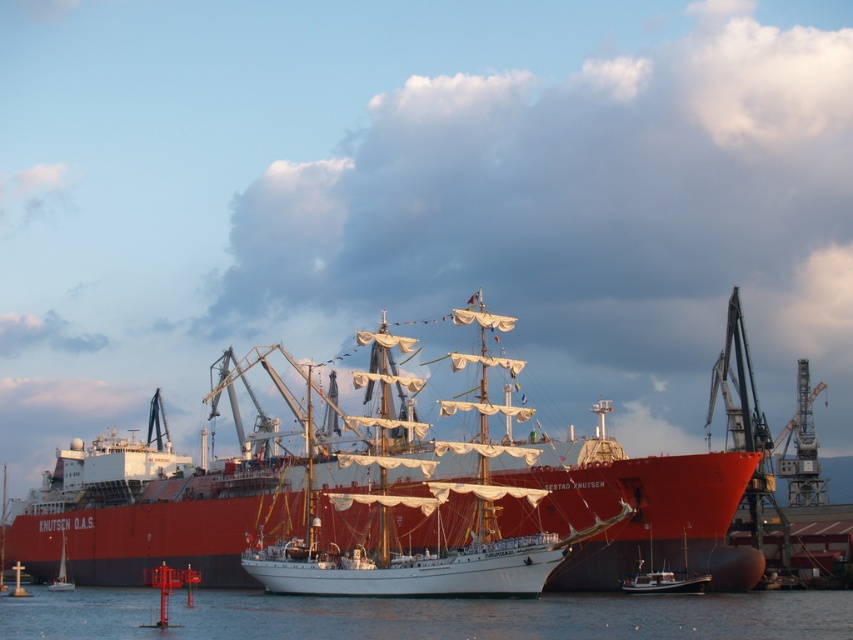
Question: Among these objects, which one is nearest to the camera?

Choices:
 (A) white sailboat at lower left
 (B) transparent water at lower center
 (C) white wooden boat at lower right

Answer: (B)

Question: Can you confirm if smooth white sailboat at center is wider than transparent water at lower center?

Choices:
 (A) yes
 (B) no

Answer: (A)

Question: Can you confirm if transparent water at lower center is bigger than white wooden boat at lower right?

Choices:
 (A) yes
 (B) no

Answer: (A)

Question: Which of the following is the closest to the observer?

Choices:
 (A) smooth white sailboat at center
 (B) white sailboat at lower left
 (C) transparent water at lower center

Answer: (C)

Question: Is smooth white sailboat at center positioned at the back of transparent water at lower center?

Choices:
 (A) yes
 (B) no

Answer: (A)

Question: Based on their relative distances, which object is nearer to the smooth white sailboat at center?

Choices:
 (A) white sailboat at lower left
 (B) transparent water at lower center

Answer: (B)